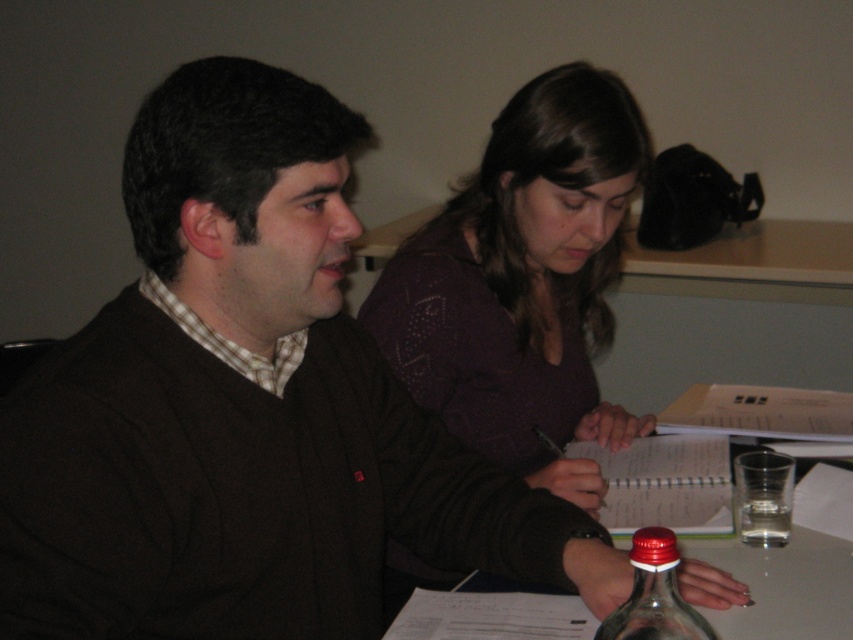
Does purple dotted sweater at upper center appear on the right side of clear glass table at center?

No, purple dotted sweater at upper center is not to the right of clear glass table at center.

Which is more to the left, purple dotted sweater at upper center or clear glass table at center?

From the viewer's perspective, purple dotted sweater at upper center appears more on the left side.

Who is more distant from viewer, (540, 204) or (614, 497)?

Positioned behind is point (614, 497).

At what (x,y) coordinates should I click in order to perform the action: click on purple dotted sweater at upper center. Please return your answer as a coordinate pair (x, y). Looking at the image, I should click on (523, 282).

This screenshot has height=640, width=853. What do you see at coordinates (782, 584) in the screenshot? I see `clear glass table at center` at bounding box center [782, 584].

Is clear glass table at center to the right of transparent glass bottle at center from the viewer's perspective?

Yes, clear glass table at center is to the right of transparent glass bottle at center.

This screenshot has width=853, height=640. I want to click on clear glass table at center, so click(x=782, y=584).

Identify the location of clear glass table at center. This screenshot has height=640, width=853. point(782,584).

Who is lower down, purple dotted sweater at upper center or transparent glass bottle at center?

transparent glass bottle at center

The image size is (853, 640). Identify the location of purple dotted sweater at upper center. (523, 282).

Which is behind, point (517, 440) or point (653, 582)?

The point (517, 440) is behind.

At what (x,y) coordinates should I click in order to perform the action: click on purple dotted sweater at upper center. Please return your answer as a coordinate pair (x, y). This screenshot has height=640, width=853. Looking at the image, I should click on (523, 282).